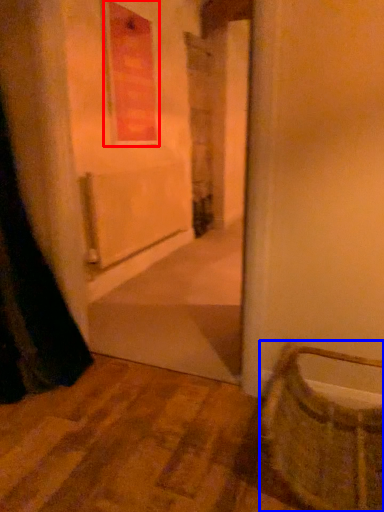
Question: Among these objects, which one is farthest to the camera, window (highlighted by a red box) or basket (highlighted by a blue box)?

Choices:
 (A) window
 (B) basket

Answer: (A)